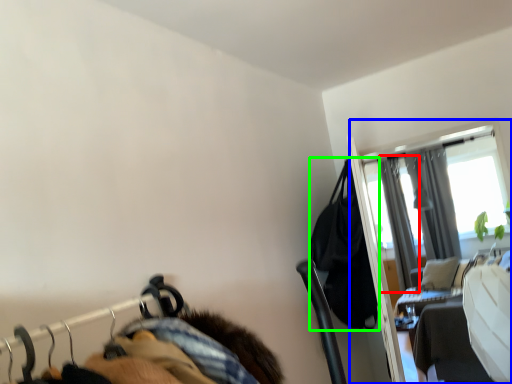
Question: Which object is positioned closest to curtain (highlighted by a red box)? Select from screen door (highlighted by a blue box) and clothing (highlighted by a green box).

Choices:
 (A) screen door
 (B) clothing

Answer: (A)